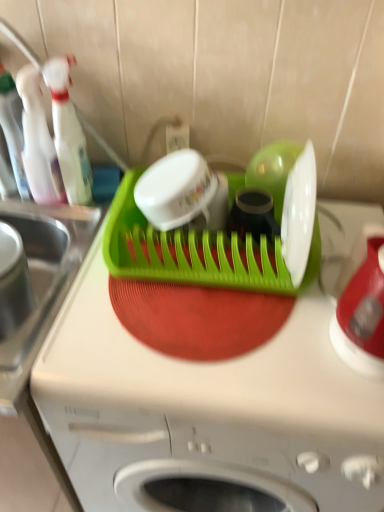
Question: Relative to translucent plastic bottle at left, which is the second bottle from left to right, is transparent plastic bottle at left, the third bottle positioned from the right, in front or behind?

Choices:
 (A) behind
 (B) front

Answer: (A)

Question: In the image, is transparent plastic bottle at left, the third bottle positioned from the right, on the left side or the right side of translucent plastic bottle at left, which is counted as the second bottle, starting from the right?

Choices:
 (A) right
 (B) left

Answer: (B)

Question: Considering the real-world distances, which object is farthest from the transparent plastic spray bottle at upper left, the first bottle viewed from the right?

Choices:
 (A) red glossy kettle at right, placed as the 1th appliance when sorted from right to left
 (B) green plastic dish rack at center
 (C) transparent plastic bottle at left, arranged as the 1th bottle when viewed from the left
 (D) translucent plastic bottle at left, which is counted as the second bottle, starting from the right
 (E) brushed metal sink at left

Answer: (A)

Question: Which of these objects is positioned farthest from the transparent plastic spray bottle at upper left, the first bottle viewed from the right?

Choices:
 (A) transparent plastic bottle at left, arranged as the 1th bottle when viewed from the left
 (B) green plastic dish rack at center, placed as the second appliance when sorted from right to left
 (C) green plastic dish rack at center
 (D) red glossy kettle at right, the 2th appliance positioned from the left
 (E) brushed metal sink at left

Answer: (D)